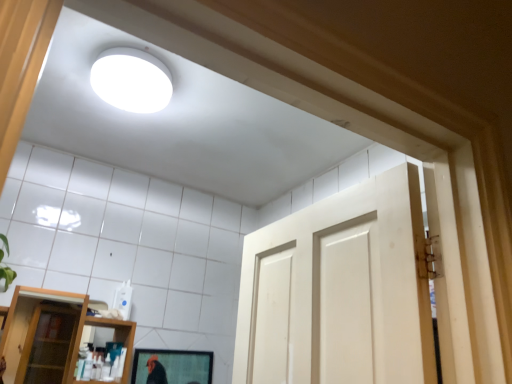
The image size is (512, 384). What are the coordinates of `white matte light fixture at upper center` in the screenshot? It's located at (131, 80).

What do you see at coordinates (172, 367) in the screenshot? This screenshot has height=384, width=512. I see `matte black mirror at lower center` at bounding box center [172, 367].

Where is `transparent glass shelf at lower left`? transparent glass shelf at lower left is located at coordinates 56,338.

Is white matte light fixture at upper center to the right of matte black mirror at lower center from the viewer's perspective?

No, white matte light fixture at upper center is not to the right of matte black mirror at lower center.

Is white matte light fixture at upper center further to the viewer compared to matte black mirror at lower center?

No, it is not.

Considering the sizes of objects white matte light fixture at upper center and matte black mirror at lower center in the image provided, who is thinner, white matte light fixture at upper center or matte black mirror at lower center?

Thinner between the two is matte black mirror at lower center.

How much distance is there between white matte light fixture at upper center and matte black mirror at lower center?

white matte light fixture at upper center and matte black mirror at lower center are 1.33 meters apart from each other.

Between white matte light fixture at upper center and transparent glass shelf at lower left, which one has less height?

white matte light fixture at upper center is shorter.

Looking at this image, from the image's perspective, between white matte light fixture at upper center and transparent glass shelf at lower left, who is located below?

transparent glass shelf at lower left, from the image's perspective.

In the scene shown: From a real-world perspective, is white matte light fixture at upper center below transparent glass shelf at lower left?

No, from a real-world perspective, white matte light fixture at upper center is not below transparent glass shelf at lower left.

Would you say white matte light fixture at upper center contains transparent glass shelf at lower left?

No.

In the scene shown: Can we say transparent glass shelf at lower left lies outside white matte light fixture at upper center?

transparent glass shelf at lower left lies outside white matte light fixture at upper center's area.

Is transparent glass shelf at lower left aimed at white matte light fixture at upper center?

No, transparent glass shelf at lower left does not turn towards white matte light fixture at upper center.

Where is `shelf located behind the white matte light fixture at upper center`? shelf located behind the white matte light fixture at upper center is located at coordinates (56, 338).

In the image, is transparent glass shelf at lower left on the left side or the right side of white matte light fixture at upper center?

Clearly, transparent glass shelf at lower left is on the left of white matte light fixture at upper center in the image.

Is matte black mirror at lower center completely or partially outside of transparent glass shelf at lower left?

Yes.

Is matte black mirror at lower center oriented away from transparent glass shelf at lower left?

No, matte black mirror at lower center is not facing the opposite direction of transparent glass shelf at lower left.

Which object is thinner, matte black mirror at lower center or transparent glass shelf at lower left?

matte black mirror at lower center is thinner.

Is matte black mirror at lower center closer to camera compared to transparent glass shelf at lower left?

No, matte black mirror at lower center is behind transparent glass shelf at lower left.

Find the location of `mirror behind the white matte light fixture at upper center`. mirror behind the white matte light fixture at upper center is located at coordinates (172, 367).

From a real-world perspective, is matte black mirror at lower center positioned above or below white matte light fixture at upper center?

matte black mirror at lower center is situated lower than white matte light fixture at upper center in the real world.

Is matte black mirror at lower center facing away from white matte light fixture at upper center?

matte black mirror at lower center does not have its back to white matte light fixture at upper center.

Considering their positions, is transparent glass shelf at lower left located in front of or behind matte black mirror at lower center?

transparent glass shelf at lower left is in front of matte black mirror at lower center.

I want to click on mirror below the transparent glass shelf at lower left (from the image's perspective), so click(172, 367).

Consider the image. What's the angular difference between transparent glass shelf at lower left and matte black mirror at lower center's facing directions?

0.343 degrees.

From the image's perspective, is transparent glass shelf at lower left located above or below matte black mirror at lower center?

transparent glass shelf at lower left is above matte black mirror at lower center.

Locate an element on the screen. mirror on the right of the white matte light fixture at upper center is located at coordinates (172, 367).

Locate an element on the screen. lighting above the transparent glass shelf at lower left (from the image's perspective) is located at coordinates (131, 80).

In the scene shown: Based on their spatial positions, is transparent glass shelf at lower left or white matte light fixture at upper center further from matte black mirror at lower center?

Among the two, transparent glass shelf at lower left is located further to matte black mirror at lower center.

When comparing their distances from transparent glass shelf at lower left, does white matte light fixture at upper center or matte black mirror at lower center seem further?

Among the two, white matte light fixture at upper center is located further to transparent glass shelf at lower left.

Considering their positions, is matte black mirror at lower center positioned further to transparent glass shelf at lower left than white matte light fixture at upper center?

white matte light fixture at upper center.

Which object lies nearer to the anchor point matte black mirror at lower center, white matte light fixture at upper center or transparent glass shelf at lower left?

The object closer to matte black mirror at lower center is white matte light fixture at upper center.

Based on the photo, estimate the real-world distances between objects in this image. Which object is further from white matte light fixture at upper center, transparent glass shelf at lower left or matte black mirror at lower center?

transparent glass shelf at lower left.

Estimate the real-world distances between objects in this image. Which object is further from white matte light fixture at upper center, matte black mirror at lower center or transparent glass shelf at lower left?

Based on the image, transparent glass shelf at lower left appears to be further to white matte light fixture at upper center.

You are a GUI agent. You are given a task and a screenshot of the screen. Output one action in this format:
    pyautogui.click(x=<x>, y=<y>)
    Task: Click on the shelf that lies between white matte light fixture at upper center and matte black mirror at lower center from top to bottom
    Image resolution: width=512 pixels, height=384 pixels.
    Given the screenshot: What is the action you would take?
    pyautogui.click(x=56, y=338)